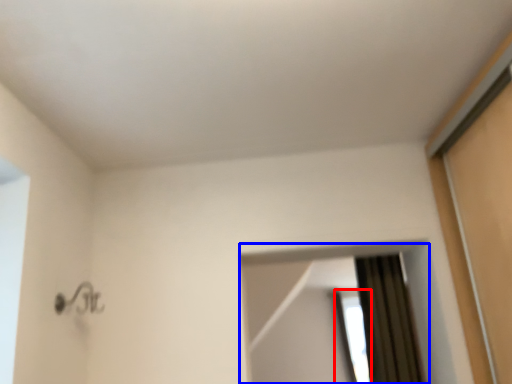
Question: Among these objects, which one is farthest to the camera, window (highlighted by a red box) or mirror (highlighted by a blue box)?

Choices:
 (A) window
 (B) mirror

Answer: (A)